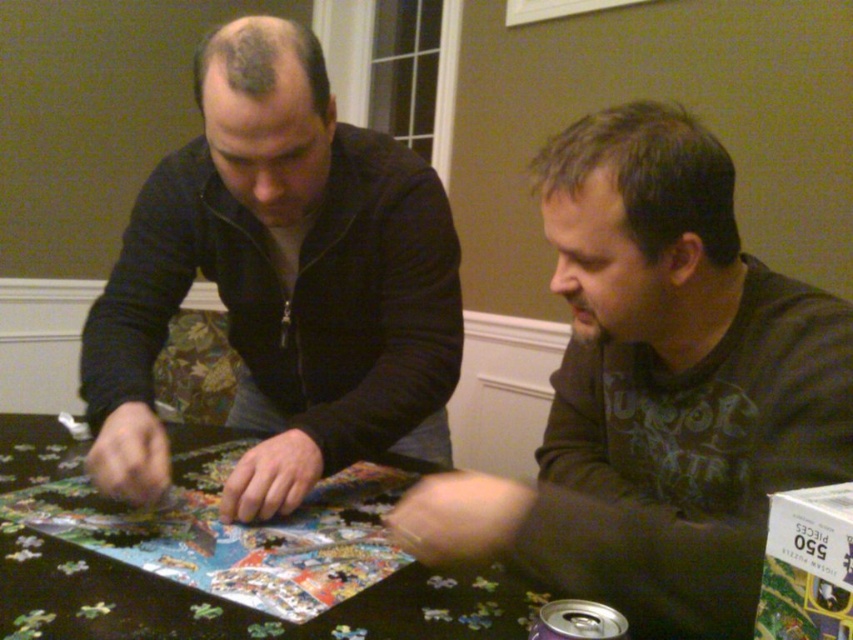
Question: Is dark blue zip-up sweater at upper left below black puzzle pieces at center?

Choices:
 (A) no
 (B) yes

Answer: (A)

Question: Which object is the closest to the black puzzle pieces at center?

Choices:
 (A) dark brown shirt at center
 (B) dark blue zip-up sweater at upper left

Answer: (B)

Question: Does dark brown shirt at center have a smaller size compared to black puzzle pieces at center?

Choices:
 (A) yes
 (B) no

Answer: (B)

Question: Is dark blue zip-up sweater at upper left to the left of black puzzle pieces at center from the viewer's perspective?

Choices:
 (A) no
 (B) yes

Answer: (A)

Question: Estimate the real-world distances between objects in this image. Which object is farther from the dark blue zip-up sweater at upper left?

Choices:
 (A) black puzzle pieces at center
 (B) dark brown shirt at center

Answer: (B)

Question: Which point appears closest to the camera in this image?

Choices:
 (A) (3, 477)
 (B) (578, 401)
 (C) (308, 60)

Answer: (C)